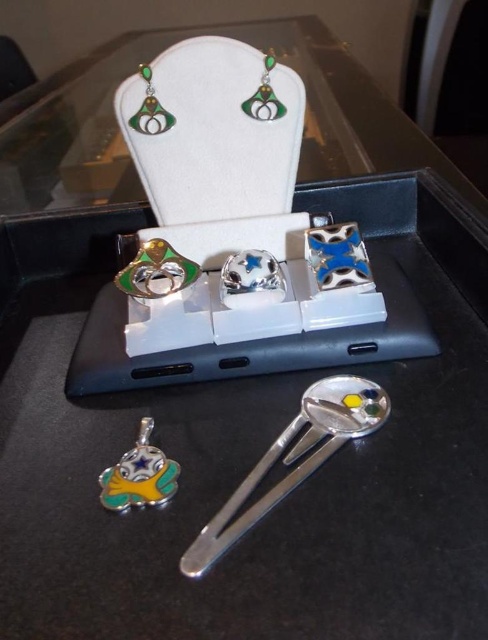
You are a jeweler who needs to pack the shiny silver spoon at lower center and the green enamel earring at upper center into a box. The box can only fit items smaller than the spoon. Will the earring fit?

The shiny silver spoon at lower center is bigger than the green enamel earring at upper center, so the earring will fit into the box since it is smaller than the spoon.

You are standing in front of the jewelry display. There are two points marked in the image. One is at coordinates point (x=322, y=390) and the other at point (x=251, y=116). Which point is closer to you?

Point (x=322, y=390) is in front of point (x=251, y=116), so it is closer to you.